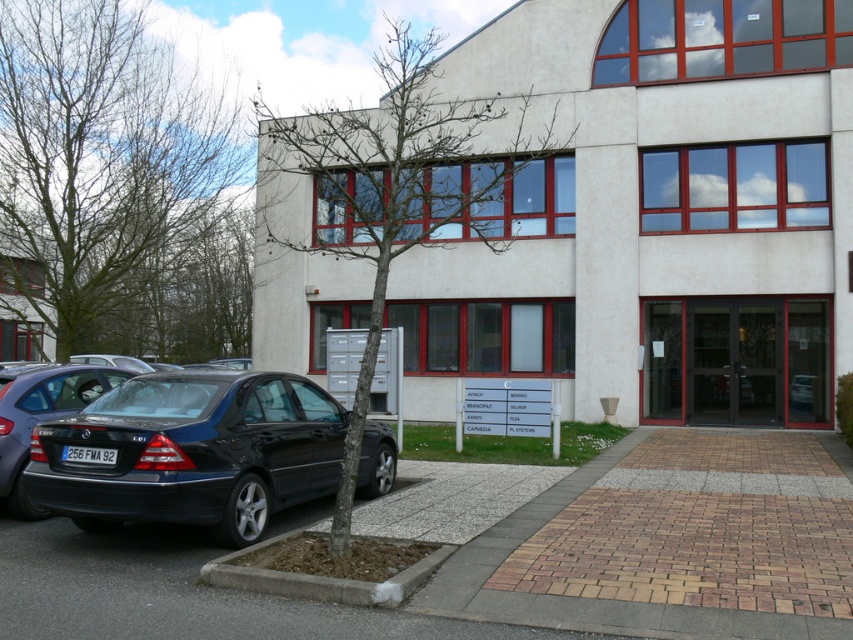
Question: Which of the following is the farthest from the observer?

Choices:
 (A) glossy black sedan at lower left
 (B) concrete at lower left
 (C) green leafless tree at left

Answer: (C)

Question: Which object is closer to the camera taking this photo?

Choices:
 (A) green leafless tree at left
 (B) bare branches at center

Answer: (B)

Question: Which point is closer to the camera?

Choices:
 (A) concrete at lower left
 (B) satin black car at lower left
 (C) bare branches at center

Answer: (A)

Question: Does green leafless tree at left come behind satin black car at lower left?

Choices:
 (A) no
 (B) yes

Answer: (B)

Question: Can you confirm if green leafless tree at left is bigger than glossy black sedan at lower left?

Choices:
 (A) yes
 (B) no

Answer: (A)

Question: Is satin black car at lower left closer to the viewer compared to concrete at lower left?

Choices:
 (A) no
 (B) yes

Answer: (A)